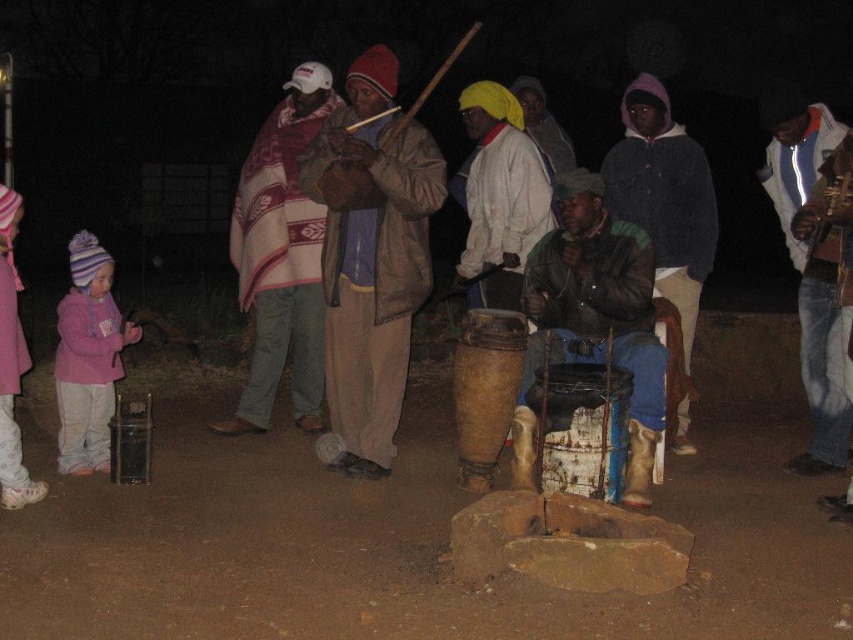
Question: Where is plaid woolen blanket at center located in relation to dark blue jacket at center in the image?

Choices:
 (A) left
 (B) right

Answer: (A)

Question: Is brown leather bag at center above plaid woolen blanket at center?

Choices:
 (A) no
 (B) yes

Answer: (A)

Question: Among these objects, which one is farthest from the camera?

Choices:
 (A) matte brown drum at center
 (B) leather jacket at center
 (C) pink fleece jacket at lower left

Answer: (A)

Question: Is brown leather bag at center wider than plaid woolen blanket at center?

Choices:
 (A) no
 (B) yes

Answer: (A)

Question: Based on their relative distances, which object is farther from the dark blue jacket at center?

Choices:
 (A) plaid woolen blanket at center
 (B) leather jacket at center
 (C) matte brown drum at center
 (D) brown leather bag at center

Answer: (A)

Question: Estimate the real-world distances between objects in this image. Which object is farther from the white and blue jacket at right?

Choices:
 (A) pink fleece jacket at lower left
 (B) matte brown drum at center
 (C) dark blue jacket at center

Answer: (A)